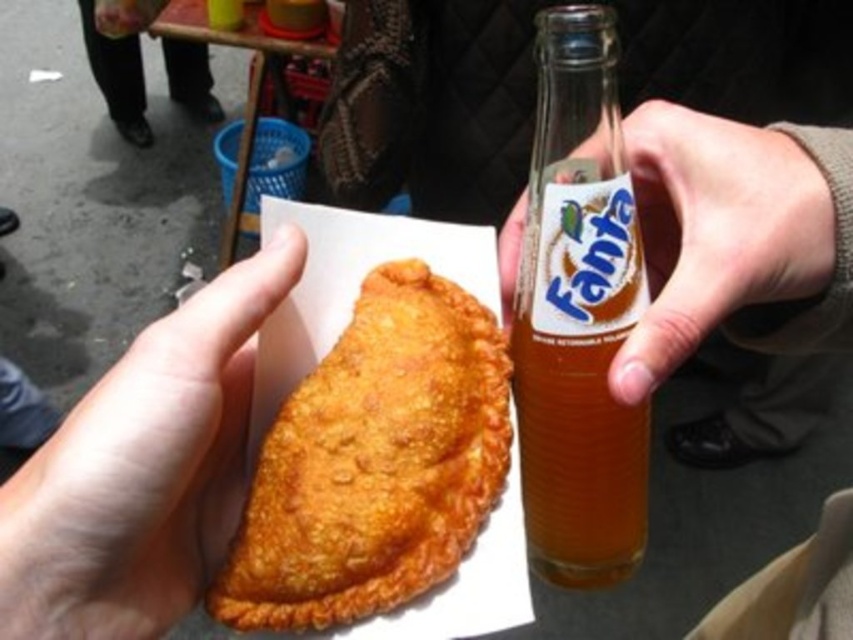
Question: Which object is farther from the camera taking this photo?

Choices:
 (A) translucent glass bottle at upper right
 (B) golden fried pastry at center
 (C) translucent glass bottle at center

Answer: (C)

Question: Can you confirm if translucent glass bottle at upper right is positioned above brown leather pants at lower center?

Choices:
 (A) yes
 (B) no

Answer: (B)

Question: Is translucent glass bottle at center further to the viewer compared to translucent glass bottle at upper right?

Choices:
 (A) yes
 (B) no

Answer: (A)

Question: Which object is positioned farthest from the golden crispy empanada at center?

Choices:
 (A) translucent glass bottle at upper right
 (B) golden fried pastry at center

Answer: (A)

Question: Which object is closer to the camera taking this photo?

Choices:
 (A) translucent glass bottle at center
 (B) translucent glass bottle at upper right
 (C) golden fried pastry at center

Answer: (C)

Question: Is golden crispy empanada at center positioned at the back of golden fried pastry at center?

Choices:
 (A) yes
 (B) no

Answer: (A)